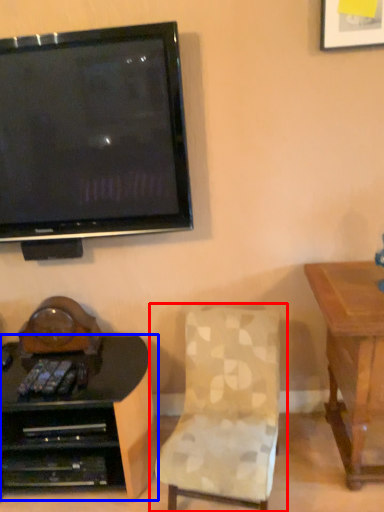
Question: Which of the following is the farthest to the observer, chair (highlighted by a red box) or desk (highlighted by a blue box)?

Choices:
 (A) chair
 (B) desk

Answer: (B)